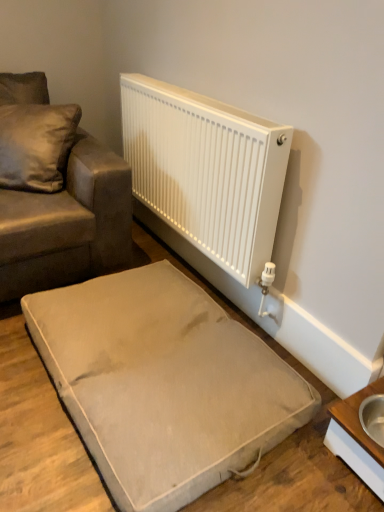
Question: From their relative heights in the image, would you say satin cushion at upper left is taller or shorter than white wood table at lower right?

Choices:
 (A) tall
 (B) short

Answer: (A)

Question: Considering the positions of point (8, 126) and point (350, 408), is point (8, 126) closer or farther from the camera than point (350, 408)?

Choices:
 (A) closer
 (B) farther

Answer: (B)

Question: Estimate the real-world distances between objects in this image. Which object is closer to the satin cushion at upper left?

Choices:
 (A) satin brown couch at upper left
 (B) white wood table at lower right
 (C) beige fabric dog bed at lower center

Answer: (A)

Question: Based on their relative distances, which object is nearer to the white wood table at lower right?

Choices:
 (A) beige fabric dog bed at lower center
 (B) satin cushion at upper left
 (C) satin brown couch at upper left

Answer: (A)